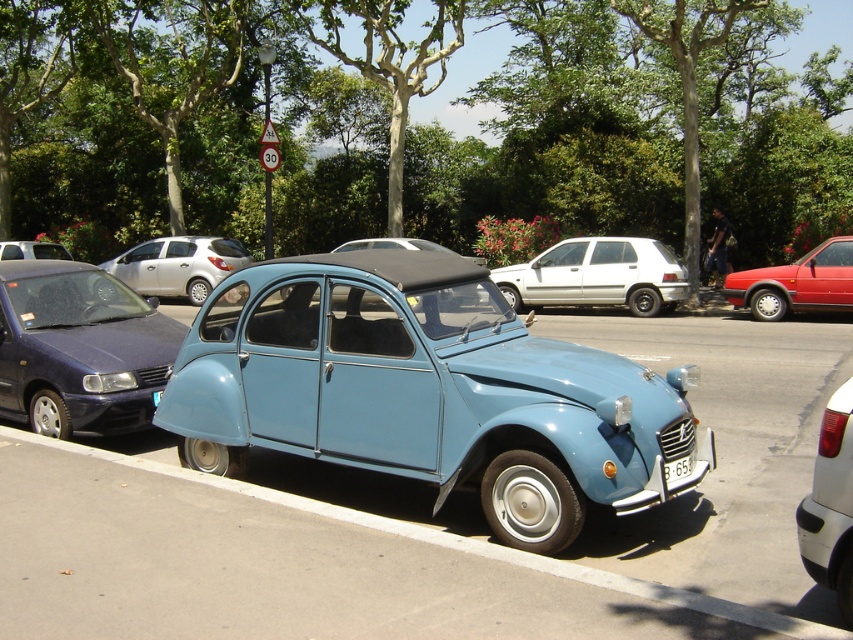
You are standing at the center of the image and want to locate the shiny red car at right. According to the coordinates provided, in which direction should you look to find it?

The shiny red car at right is located at coordinates point (796, 282). Since you are at the center, you should look towards the upper right direction to find it.

You are a photographer trying to capture the metallic blue car at center and the white glossy tail light at lower right in a single shot. Considering their sizes, which object will appear bigger in the photo?

The metallic blue car at center will appear bigger in the photo since it is larger in size than the white glossy tail light at lower right.